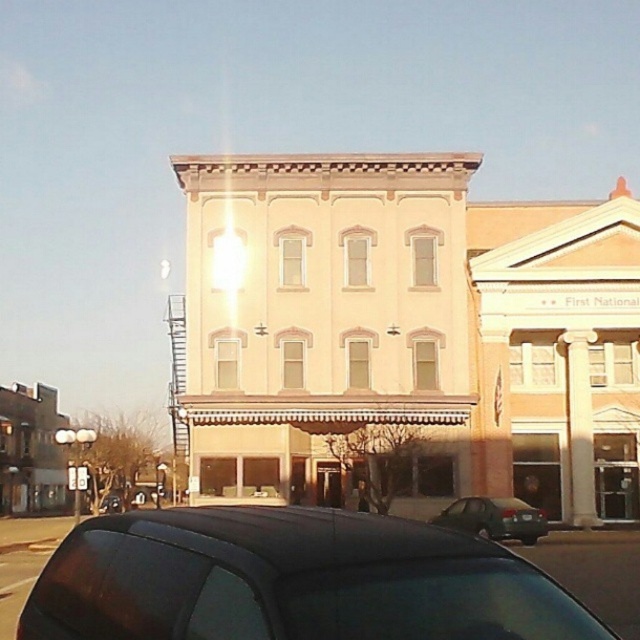
You are standing at point (193, 230) and want to walk to the other side of the street. The street is 111.06 feet wide. If your walking speed is 3 feet per second, how many seconds will it take you to cross the street?

The street is 111.06 feet wide. At a walking speed of 3 feet per second, it will take 111.06 divided by 3, which equals approximately 37.02 seconds to cross the street.

You are a pedestrian standing on the sidewalk and want to cross the street to reach the two buildings. You see a black matte car at lower center and a green matte sedan at lower center. Which car is closer to the building on the left?

The black matte car at lower center is closer to the building on the left because it is positioned to the left of the green matte sedan at lower center, which is closer to the building on the left.